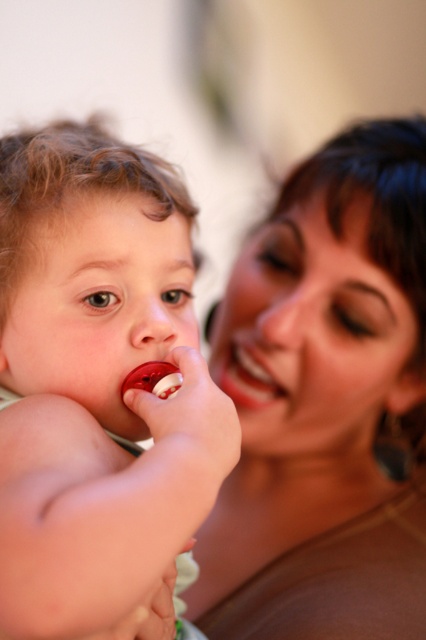
Question: Can you confirm if rubber pacifier at left is positioned to the left of smooth matte lips at center?

Choices:
 (A) no
 (B) yes

Answer: (B)

Question: Which object is positioned closest to the smooth matte lips at center?

Choices:
 (A) smooth skin face at upper right
 (B) rubber pacifier at left

Answer: (A)

Question: Estimate the real-world distances between objects in this image. Which object is closer to the rubber pacifier at left?

Choices:
 (A) smooth matte lips at center
 (B) smooth skin face at upper right

Answer: (B)

Question: Estimate the real-world distances between objects in this image. Which object is farther from the rubber pacifier at left?

Choices:
 (A) smooth skin face at upper right
 (B) smooth matte lips at center

Answer: (B)

Question: Observing the image, what is the correct spatial positioning of smooth skin face at upper right in reference to rubber pacifier at left?

Choices:
 (A) below
 (B) above

Answer: (A)

Question: Does smooth skin face at upper right appear on the left side of rubber pacifier at left?

Choices:
 (A) yes
 (B) no

Answer: (B)